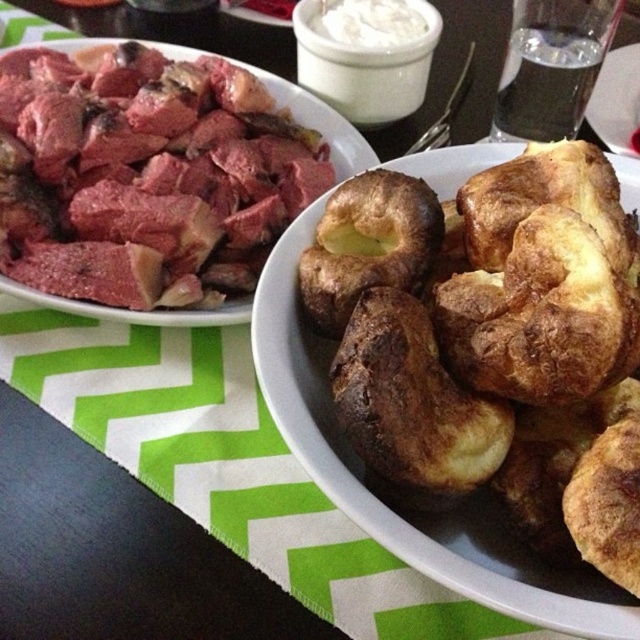
Is point (460, 410) positioned in front of point (1, 49)?

Yes, point (460, 410) is closer to viewer.

Does golden brown crusty yorkshire pudding at center have a greater width compared to pinkish matte meat at upper left?

Incorrect, golden brown crusty yorkshire pudding at center's width does not surpass pinkish matte meat at upper left's.

Who is more distant from viewer, [355,360] or [192,317]?

The point [192,317] is behind.

The height and width of the screenshot is (640, 640). In order to click on golden brown crusty yorkshire pudding at center in this screenshot , I will do click(x=492, y=340).